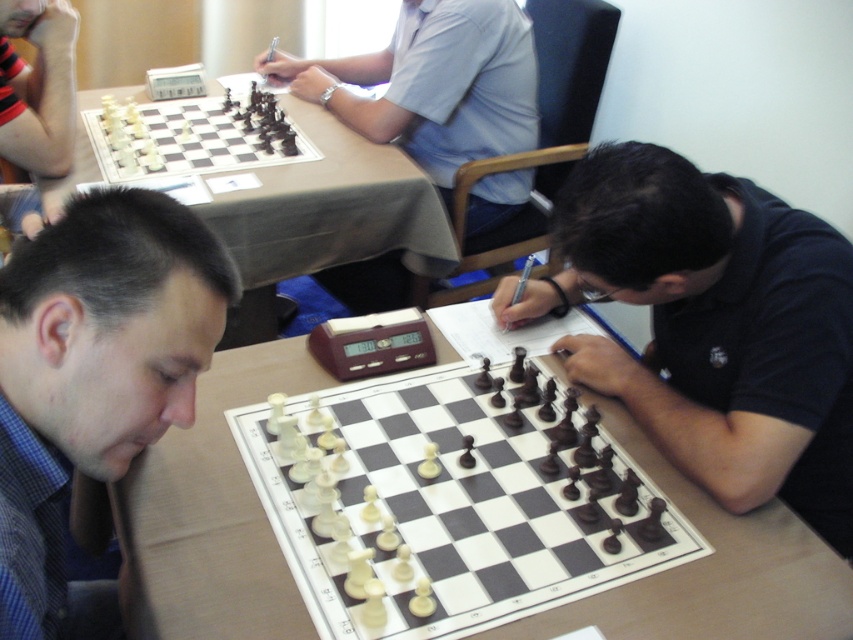
Question: Which object is closer to the camera taking this photo?

Choices:
 (A) white plastic chess pieces at upper left
 (B) wooden chessboard at center
 (C) wooden table at center

Answer: (C)

Question: Does dark blue shirt at right appear under wooden chessboard at center?

Choices:
 (A) yes
 (B) no

Answer: (A)

Question: Is matte light blue shirt at upper center bigger than striped fabric arm at upper left?

Choices:
 (A) yes
 (B) no

Answer: (A)

Question: Can you confirm if wooden chessboard at center is positioned below striped fabric arm at upper left?

Choices:
 (A) no
 (B) yes

Answer: (B)

Question: Among these objects, which one is farthest from the camera?

Choices:
 (A) dark blue shirt at right
 (B) white plastic chess pieces at upper left

Answer: (B)

Question: Which point appears farthest from the camera in this image?

Choices:
 (A) (70, 13)
 (B) (86, 308)
 (C) (848, 582)

Answer: (A)